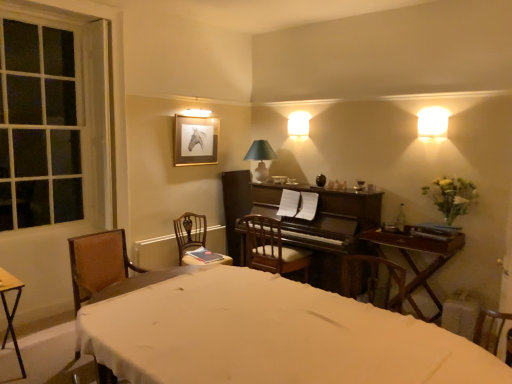
What do you see at coordinates (195, 140) in the screenshot? Image resolution: width=512 pixels, height=384 pixels. I see `gold-framed horse portrait at upper center` at bounding box center [195, 140].

What do you see at coordinates (333, 232) in the screenshot?
I see `dark wood piano at center` at bounding box center [333, 232].

What are the coordinates of `white fabric bed at lower left` in the screenshot? It's located at (270, 336).

Looking at this image, in order to face clear glass bottle at right, should I rotate leftwards or rightwards?

You should rotate right by 19.160 degrees.

Measure the distance between point [264,250] and camera.

Point [264,250] and camera are 13.37 feet apart.

Where is `brown fabric chair at left, which appears as the third chair when viewed from the right`? This screenshot has width=512, height=384. brown fabric chair at left, which appears as the third chair when viewed from the right is located at coordinates (98, 263).

How much space does brown fabric chair at left, which appears as the third chair when viewed from the right, occupy horizontally?

brown fabric chair at left, which appears as the third chair when viewed from the right, is 55.24 centimeters wide.

Find the location of a particular element. This screenshot has height=384, width=512. gold-framed horse portrait at upper center is located at coordinates (195, 140).

In terms of size, does gold-framed horse portrait at upper center appear bigger or smaller than brown wooden chair at center, placed as the 2th chair when sorted from left to right?

Clearly, gold-framed horse portrait at upper center is smaller in size than brown wooden chair at center, placed as the 2th chair when sorted from left to right.

How different are the orientations of gold-framed horse portrait at upper center and brown wooden chair at center, arranged as the 2th chair when viewed from the right, in degrees?

gold-framed horse portrait at upper center and brown wooden chair at center, arranged as the 2th chair when viewed from the right, are facing 1.49 degrees away from each other.

Is gold-framed horse portrait at upper center to the left of brown wooden chair at center, arranged as the 2th chair when viewed from the right, from the viewer's perspective?

Indeed, gold-framed horse portrait at upper center is positioned on the left side of brown wooden chair at center, arranged as the 2th chair when viewed from the right.

Is clear glass bottle at right looking in the opposite direction of brown wooden chair at center, arranged as the 2th chair when viewed from the right?

No, clear glass bottle at right is not facing away from brown wooden chair at center, arranged as the 2th chair when viewed from the right.

How different are the orientations of clear glass bottle at right and brown wooden chair at center, placed as the 2th chair when sorted from left to right, in degrees?

There is a 88.1-degree angle between the facing directions of clear glass bottle at right and brown wooden chair at center, placed as the 2th chair when sorted from left to right.

Would you say clear glass bottle at right is inside or outside brown wooden chair at center, arranged as the 2th chair when viewed from the right?

clear glass bottle at right is spatially situated outside brown wooden chair at center, arranged as the 2th chair when viewed from the right.

Considering the sizes of objects clear glass bottle at right and brown wooden chair at center, arranged as the 2th chair when viewed from the right, in the image provided, who is smaller, clear glass bottle at right or brown wooden chair at center, arranged as the 2th chair when viewed from the right,?

clear glass bottle at right.

Does white matte vase at right have a greater width compared to wooden table at right?

In fact, white matte vase at right might be narrower than wooden table at right.

From the image's perspective, which is above, white matte vase at right or wooden table at right?

white matte vase at right appears higher in the image.

Looking at this image, between white matte vase at right and wooden table at right, which one has smaller size?

With smaller size is white matte vase at right.

Is white matte vase at right in contact with wooden table at right?

They are not placed beside each other.

Is green fabric lampshade at upper center, the first lamp when ordered from bottom to top, placed right next to brown fabric chair at left, which appears as the third chair when viewed from the right?

No.

Between point (259, 171) and point (76, 278), which one is positioned in front?

The point (76, 278) is more forward.

What's the angular difference between green fabric lampshade at upper center, the 2th lamp in the top-to-bottom sequence, and brown fabric chair at left, which appears as the third chair when viewed from the right,'s facing directions?

green fabric lampshade at upper center, the 2th lamp in the top-to-bottom sequence, and brown fabric chair at left, which appears as the third chair when viewed from the right, are facing 91.4 degrees away from each other.

From a real-world perspective, which object stands above the other?

green fabric lampshade at upper center, positioned as the 2th lamp in right-to-left order, is physically above.

Considering the sizes of brown fabric chair at left, which appears as the third chair when viewed from the right, and yellow wood desk at lower left in the image, is brown fabric chair at left, which appears as the third chair when viewed from the right, taller or shorter than yellow wood desk at lower left?

brown fabric chair at left, which appears as the third chair when viewed from the right, is taller than yellow wood desk at lower left.

Is brown fabric chair at left, which appears as the third chair when viewed from the right, surrounding yellow wood desk at lower left?

Definitely not — yellow wood desk at lower left is not inside brown fabric chair at left, which appears as the third chair when viewed from the right.

From a real-world perspective, is brown fabric chair at left, which appears as the third chair when viewed from the right, physically below yellow wood desk at lower left?

No, from a real-world perspective, brown fabric chair at left, which appears as the third chair when viewed from the right, is not under yellow wood desk at lower left.

Considering the relative positions of brown fabric chair at left, which appears as the third chair when viewed from the right, and yellow wood desk at lower left in the image provided, is brown fabric chair at left, which appears as the third chair when viewed from the right, to the left of yellow wood desk at lower left from the viewer's perspective?

No, brown fabric chair at left, which appears as the third chair when viewed from the right, is not to the left of yellow wood desk at lower left.

Identify the location of window on the left of the brown fabric chair at left, the 1th chair from the left. The height and width of the screenshot is (384, 512). (54, 119).

Is brown fabric chair at left, which appears as the third chair when viewed from the right, bigger or smaller than clear glass window at left?

brown fabric chair at left, which appears as the third chair when viewed from the right, is bigger than clear glass window at left.

Is brown fabric chair at left, the 1th chair from the left, facing towards clear glass window at left?

No, brown fabric chair at left, the 1th chair from the left, is not turned towards clear glass window at left.

Can you confirm if brown fabric chair at left, the 1th chair from the left, is shorter than clear glass window at left?

Indeed, brown fabric chair at left, the 1th chair from the left, has a lesser height compared to clear glass window at left.

Between wooden chair with cushion at center, the 3th chair when ordered from left to right, and wooden table at right, which one has less height?

Standing shorter between the two is wooden chair with cushion at center, the 3th chair when ordered from left to right.

Locate an element on the screen. The width and height of the screenshot is (512, 384). the 2nd chair above the wooden table at right (from a real-world perspective) is located at coordinates (272, 248).

Which is more to the left, wooden chair with cushion at center, the 3th chair when ordered from left to right, or wooden table at right?

wooden chair with cushion at center, the 3th chair when ordered from left to right.

Which object is closer to the camera taking this photo, wooden chair with cushion at center, acting as the 1th chair starting from the right, or wooden table at right?

wooden table at right is closer to the camera.

From a real-world perspective, count 1st chairs downward from the gold-framed horse portrait at upper center and point to it. Please provide its 2D coordinates.

[(190, 233)]

Locate an element on the screen. bottle behind the brown wooden chair at center, placed as the 2th chair when sorted from left to right is located at coordinates (400, 219).

From the image, which object appears to be farther from matte glass lampshade at upper center, the 2th lamp in the bottom-to-top sequence, brown fabric chair at left, which appears as the third chair when viewed from the right, or clear glass window at left?

Among the two, brown fabric chair at left, which appears as the third chair when viewed from the right, is located further to matte glass lampshade at upper center, the 2th lamp in the bottom-to-top sequence.

Estimate the real-world distances between objects in this image. Which object is closer to yellow wood desk at lower left, gold-framed horse portrait at upper center or clear glass window at left?

clear glass window at left is closer to yellow wood desk at lower left.

From the image, which object appears to be nearer to dark wood piano at center, white fabric bed at lower left or brown wooden chair at center, placed as the 2th chair when sorted from left to right?

brown wooden chair at center, placed as the 2th chair when sorted from left to right, is positioned closer to the anchor dark wood piano at center.

Based on their spatial positions, is brown fabric chair at left, which appears as the third chair when viewed from the right, or brown wooden chair at center, arranged as the 2th chair when viewed from the right, further from white fabric bed at lower left?

Among the two, brown wooden chair at center, arranged as the 2th chair when viewed from the right, is located further to white fabric bed at lower left.

Which object lies further to the anchor point clear glass window at left, white fabric bed at lower left or wooden chair with cushion at center, acting as the 1th chair starting from the right?

white fabric bed at lower left is further to clear glass window at left.

Based on their spatial positions, is brown wooden chair at center, placed as the 2th chair when sorted from left to right, or yellow wood desk at lower left closer to clear glass bottle at right?

The object closer to clear glass bottle at right is brown wooden chair at center, placed as the 2th chair when sorted from left to right.

Estimate the real-world distances between objects in this image. Which object is closer to matte glass lampshade at upper center, acting as the second lamp starting from the left, gold-framed horse portrait at upper center or brown fabric chair at left, the 1th chair from the left?

Based on the image, gold-framed horse portrait at upper center appears to be nearer to matte glass lampshade at upper center, acting as the second lamp starting from the left.

Looking at the image, which one is located closer to gold-framed horse portrait at upper center, clear glass window at left or brown fabric chair at left, the 1th chair from the left?

Among the two, clear glass window at left is located nearer to gold-framed horse portrait at upper center.

Identify the location of table located between white fabric bed at lower left and green fabric lampshade at upper center, the 2th lamp in the top-to-bottom sequence, in the depth direction. (418, 251).

Where is `desk between white fabric bed at lower left and brown fabric chair at left, which appears as the third chair when viewed from the right, along the z-axis`? The width and height of the screenshot is (512, 384). desk between white fabric bed at lower left and brown fabric chair at left, which appears as the third chair when viewed from the right, along the z-axis is located at coordinates (12, 310).

Where is `window between white fabric bed at lower left and brown wooden chair at center, placed as the 2th chair when sorted from left to right, along the z-axis`? window between white fabric bed at lower left and brown wooden chair at center, placed as the 2th chair when sorted from left to right, along the z-axis is located at coordinates (54, 119).

Where is `flower positioned between white fabric bed at lower left and clear glass bottle at right from near to far`? The width and height of the screenshot is (512, 384). flower positioned between white fabric bed at lower left and clear glass bottle at right from near to far is located at coordinates (451, 196).